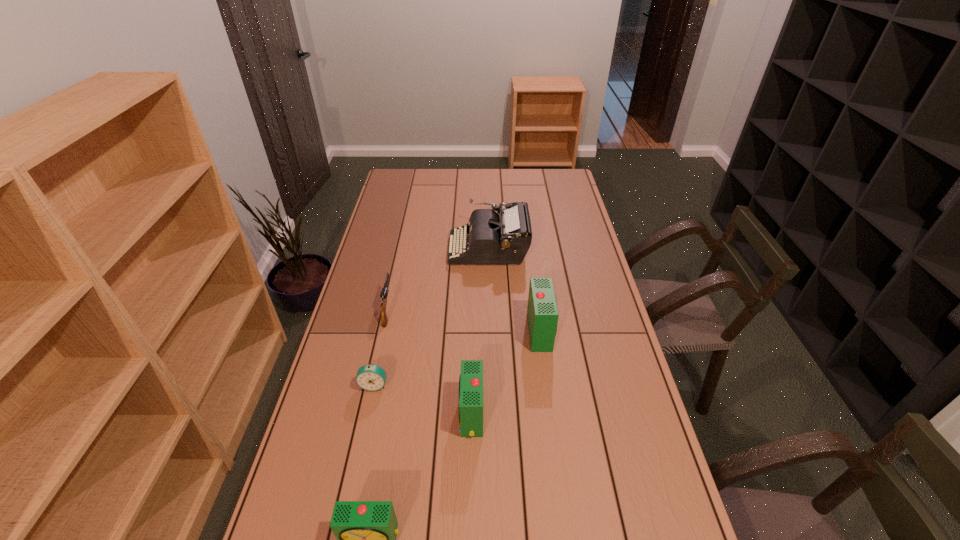
Find the location of a particular element. The image size is (960, 540). free space between the shortest alarm clock and the farthest object is located at coordinates (431, 316).

Locate an element on the screen. This screenshot has height=540, width=960. object identified as the fourth closest to the typewriter is located at coordinates (471, 378).

Choose which object is the fourth nearest neighbor to the farthest object. Please provide its 2D coordinates. Your answer should be formatted as a tuple, i.e. [(x, y)], where the tuple contains the x and y coordinates of a point satisfying the conditions above.

[(471, 378)]

This screenshot has width=960, height=540. Identify the location of the second closest alarm clock to the farthest object. (371, 377).

Select which alarm clock is the closest to the third shortest object. Please provide its 2D coordinates. Your answer should be formatted as a tuple, i.e. [(x, y)], where the tuple contains the x and y coordinates of a point satisfying the conditions above.

[(471, 378)]